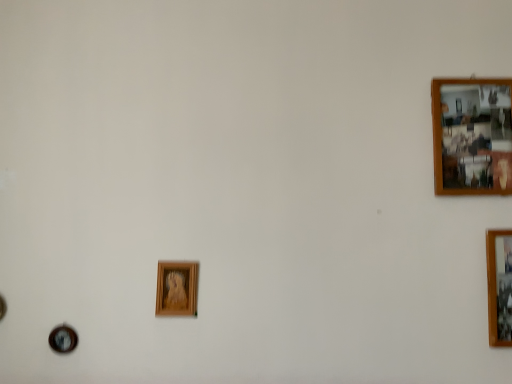
At what (x,y) coordinates should I click in order to perform the action: click on wooden picture frame at center, the third picture frame positioned from the top. Please return your answer as a coordinate pair (x, y). The image size is (512, 384). Looking at the image, I should click on (177, 288).

This screenshot has height=384, width=512. Find the location of `wooden photo frame at upper right, acting as the 2th picture frame starting from the right`. wooden photo frame at upper right, acting as the 2th picture frame starting from the right is located at coordinates (472, 136).

Is wooden photo frame at right, marked as the 2th picture frame in a bottom-to-top arrangement, completely or partially outside of wooden photo frame at upper right, marked as the 3th picture frame in a bottom-to-top arrangement?

Yes, wooden photo frame at right, marked as the 2th picture frame in a bottom-to-top arrangement, is not within wooden photo frame at upper right, marked as the 3th picture frame in a bottom-to-top arrangement.

Looking at this image, is wooden photo frame at right, the 3th picture frame when ordered from left to right, aimed at wooden photo frame at upper right, marked as the 3th picture frame in a bottom-to-top arrangement?

No, wooden photo frame at right, the 3th picture frame when ordered from left to right, is not oriented towards wooden photo frame at upper right, marked as the 3th picture frame in a bottom-to-top arrangement.

Does wooden photo frame at right, the 3th picture frame when ordered from left to right, have a smaller size compared to wooden photo frame at upper right, marked as the 3th picture frame in a bottom-to-top arrangement?

Actually, wooden photo frame at right, the 3th picture frame when ordered from left to right, might be larger than wooden photo frame at upper right, marked as the 3th picture frame in a bottom-to-top arrangement.

From the image's perspective, would you say wooden photo frame at right, the 1th picture frame when ordered from right to left, is shown under wooden photo frame at upper right, acting as the 2th picture frame starting from the right?

Yes, from the image's perspective, wooden photo frame at right, the 1th picture frame when ordered from right to left, is beneath wooden photo frame at upper right, acting as the 2th picture frame starting from the right.

From the image's perspective, who appears lower, wooden photo frame at upper right, which appears as the first picture frame when viewed from the top, or wooden photo frame at right, the 2th picture frame from the top?

From the image's view, wooden photo frame at right, the 2th picture frame from the top, is below.

Can you confirm if wooden photo frame at upper right, which appears as the first picture frame when viewed from the top, is shorter than wooden photo frame at right, the 2th picture frame from the top?

No.

Does point (502, 88) come farther from viewer compared to point (495, 292)?

Yes, it is behind point (495, 292).

Is the depth of wooden photo frame at upper right, marked as the 3th picture frame in a bottom-to-top arrangement, greater than that of wooden photo frame at right, the 3th picture frame when ordered from left to right?

Yes, the depth of wooden photo frame at upper right, marked as the 3th picture frame in a bottom-to-top arrangement, is greater than that of wooden photo frame at right, the 3th picture frame when ordered from left to right.

Consider the image. Which is in front, wooden picture frame at center, arranged as the 1th picture frame when ordered from the bottom, or wooden photo frame at right, the 3th picture frame when ordered from left to right?

wooden photo frame at right, the 3th picture frame when ordered from left to right, is in front.

Which is more to the left, wooden picture frame at center, the third picture frame positioned from the top, or wooden photo frame at right, marked as the 2th picture frame in a bottom-to-top arrangement?

Positioned to the left is wooden picture frame at center, the third picture frame positioned from the top.

From the image's perspective, which is below, wooden picture frame at center, the 1th picture frame from the left, or wooden photo frame at right, the 3th picture frame when ordered from left to right?

wooden picture frame at center, the 1th picture frame from the left, appears lower in the image.

From a real-world perspective, is wooden picture frame at center, arranged as the 1th picture frame when ordered from the bottom, under wooden photo frame at right, the 3th picture frame when ordered from left to right?

No, from a real-world perspective, wooden picture frame at center, arranged as the 1th picture frame when ordered from the bottom, is not beneath wooden photo frame at right, the 3th picture frame when ordered from left to right.

Which is behind, point (494, 322) or point (191, 294)?

Point (191, 294)

Are wooden photo frame at right, the 1th picture frame when ordered from right to left, and wooden picture frame at center, arranged as the 1th picture frame when ordered from the bottom, far apart?

That's not correct — wooden photo frame at right, the 1th picture frame when ordered from right to left, is a little close to wooden picture frame at center, arranged as the 1th picture frame when ordered from the bottom.

In the image, is wooden photo frame at right, the 3th picture frame when ordered from left to right, positioned in front of or behind wooden picture frame at center, the third picture frame positioned from the top?

wooden photo frame at right, the 3th picture frame when ordered from left to right, is in front of wooden picture frame at center, the third picture frame positioned from the top.

Is wooden photo frame at right, the 1th picture frame when ordered from right to left, outside of wooden picture frame at center, the third picture frame positioned from the top?

Yes.

Does wooden picture frame at center, the 3th picture frame in the right-to-left sequence, have a larger size compared to wooden photo frame at upper right, marked as the 3th picture frame in a bottom-to-top arrangement?

Actually, wooden picture frame at center, the 3th picture frame in the right-to-left sequence, might be smaller than wooden photo frame at upper right, marked as the 3th picture frame in a bottom-to-top arrangement.

Measure the distance from wooden picture frame at center, arranged as the 1th picture frame when ordered from the bottom, to wooden photo frame at upper right, acting as the 2th picture frame starting from the right.

The distance of wooden picture frame at center, arranged as the 1th picture frame when ordered from the bottom, from wooden photo frame at upper right, acting as the 2th picture frame starting from the right, is 32.79 inches.

How different are the orientations of wooden picture frame at center, the 1th picture frame from the left, and wooden photo frame at upper right, which appears as the first picture frame when viewed from the top, in degrees?

1.12 degrees separate the facing orientations of wooden picture frame at center, the 1th picture frame from the left, and wooden photo frame at upper right, which appears as the first picture frame when viewed from the top.

From a real-world perspective, is wooden picture frame at center, the third picture frame positioned from the top, over wooden photo frame at upper right, which appears as the first picture frame when viewed from the top?

No, from a real-world perspective, wooden picture frame at center, the third picture frame positioned from the top, is not over wooden photo frame at upper right, which appears as the first picture frame when viewed from the top

Locate an element on the screen. Image resolution: width=512 pixels, height=384 pixels. the 1st picture frame to the right when counting from the wooden picture frame at center, arranged as the 1th picture frame when ordered from the bottom is located at coordinates (472, 136).

Would you say wooden photo frame at upper right, the 2th picture frame from the left, is to the left or to the right of wooden picture frame at center, the 1th picture frame from the left, in the picture?

Clearly, wooden photo frame at upper right, the 2th picture frame from the left, is on the right of wooden picture frame at center, the 1th picture frame from the left, in the image.

From a real-world perspective, which is physically above, wooden photo frame at upper right, acting as the 2th picture frame starting from the right, or wooden picture frame at center, the 1th picture frame from the left?

wooden photo frame at upper right, acting as the 2th picture frame starting from the right, is physically above.

Is wooden photo frame at upper right, which appears as the first picture frame when viewed from the top, taller than wooden picture frame at center, the third picture frame positioned from the top?

Yes, wooden photo frame at upper right, which appears as the first picture frame when viewed from the top, is taller than wooden picture frame at center, the third picture frame positioned from the top.

Identify the location of the 2nd picture frame in front of the wooden photo frame at upper right, which appears as the first picture frame when viewed from the top. (499, 286).

Find the location of a particular element. the 1st picture frame to the left of the wooden photo frame at right, the 2th picture frame from the top, counting from the anchor's position is located at coordinates (472, 136).

Looking at the image, which one is located closer to wooden picture frame at center, arranged as the 1th picture frame when ordered from the bottom, wooden photo frame at right, the 1th picture frame when ordered from right to left, or wooden photo frame at upper right, the 2th picture frame from the left?

wooden photo frame at upper right, the 2th picture frame from the left, is positioned closer to the anchor wooden picture frame at center, arranged as the 1th picture frame when ordered from the bottom.

Looking at the image, which one is located further to wooden photo frame at right, the 1th picture frame when ordered from right to left, wooden photo frame at upper right, acting as the 2th picture frame starting from the right, or wooden picture frame at center, the third picture frame positioned from the top?

wooden picture frame at center, the third picture frame positioned from the top.

Which object lies further to the anchor point wooden photo frame at right, the 1th picture frame when ordered from right to left, wooden picture frame at center, arranged as the 1th picture frame when ordered from the bottom, or wooden photo frame at upper right, which appears as the first picture frame when viewed from the top?

The object further to wooden photo frame at right, the 1th picture frame when ordered from right to left, is wooden picture frame at center, arranged as the 1th picture frame when ordered from the bottom.

Which object lies further to the anchor point wooden photo frame at upper right, which appears as the first picture frame when viewed from the top, wooden photo frame at right, the 2th picture frame from the top, or wooden picture frame at center, arranged as the 1th picture frame when ordered from the bottom?

wooden picture frame at center, arranged as the 1th picture frame when ordered from the bottom, lies further to wooden photo frame at upper right, which appears as the first picture frame when viewed from the top, than the other object.

When comparing their distances from wooden photo frame at upper right, marked as the 3th picture frame in a bottom-to-top arrangement, does wooden picture frame at center, arranged as the 1th picture frame when ordered from the bottom, or wooden photo frame at right, the 2th picture frame from the top, seem further?

Among the two, wooden picture frame at center, arranged as the 1th picture frame when ordered from the bottom, is located further to wooden photo frame at upper right, marked as the 3th picture frame in a bottom-to-top arrangement.

Estimate the real-world distances between objects in this image. Which object is further from wooden picture frame at center, the 1th picture frame from the left, wooden photo frame at upper right, the 2th picture frame from the left, or wooden photo frame at right, the 3th picture frame when ordered from left to right?

Among the two, wooden photo frame at right, the 3th picture frame when ordered from left to right, is located further to wooden picture frame at center, the 1th picture frame from the left.

Where is `picture frame situated between wooden picture frame at center, the third picture frame positioned from the top, and wooden photo frame at right, the 3th picture frame when ordered from left to right, from left to right`? This screenshot has width=512, height=384. picture frame situated between wooden picture frame at center, the third picture frame positioned from the top, and wooden photo frame at right, the 3th picture frame when ordered from left to right, from left to right is located at coordinates (472, 136).